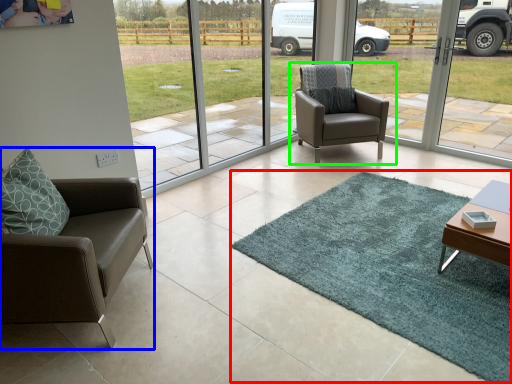
Question: Which object is the farthest from mat (highlighted by a red box)? Choose among these: chair (highlighted by a blue box) or chair (highlighted by a green box).

Choices:
 (A) chair
 (B) chair

Answer: (B)